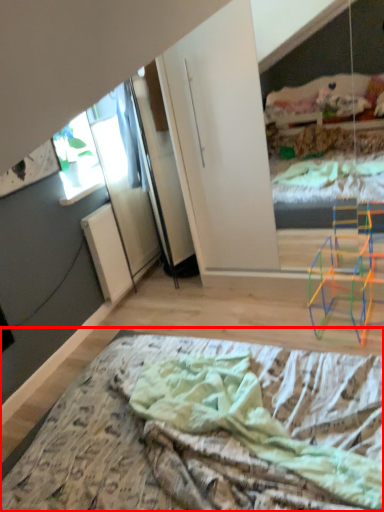
Question: From the image's perspective, where is bed (annotated by the red box) located in relation to window in the image?

Choices:
 (A) above
 (B) below

Answer: (B)